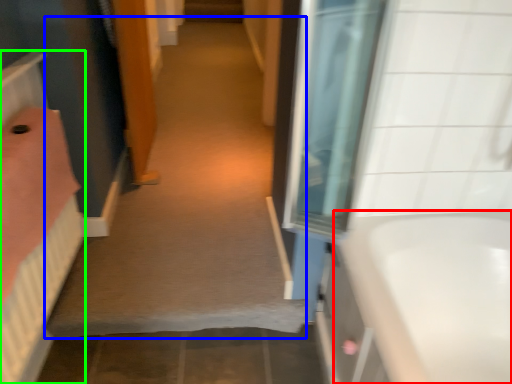
Question: Which object is the farthest from bathtub (highlighted by a red box)? Choose among these: plain (highlighted by a blue box) or bed (highlighted by a green box).

Choices:
 (A) plain
 (B) bed

Answer: (B)